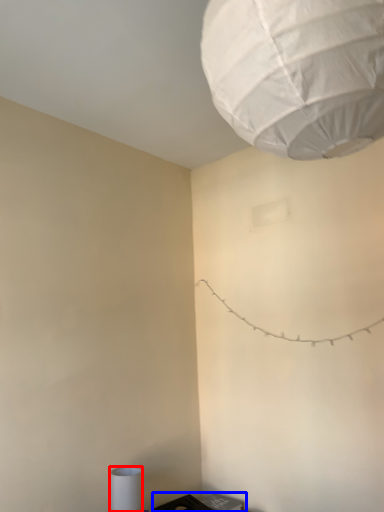
Question: Which object appears closest to the camera in this image, lamp (highlighted by a red box) or furniture (highlighted by a blue box)?

Choices:
 (A) lamp
 (B) furniture

Answer: (A)